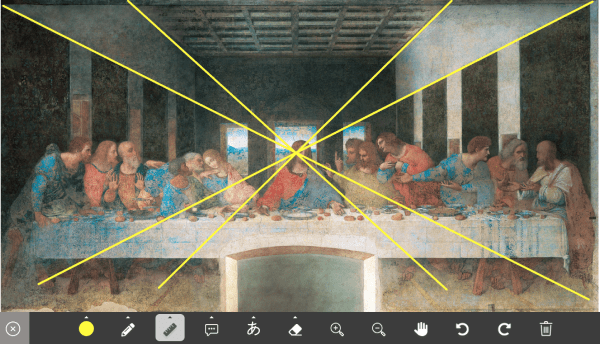
The width and height of the screenshot is (600, 344). Identify the location of trash can. (547, 328).